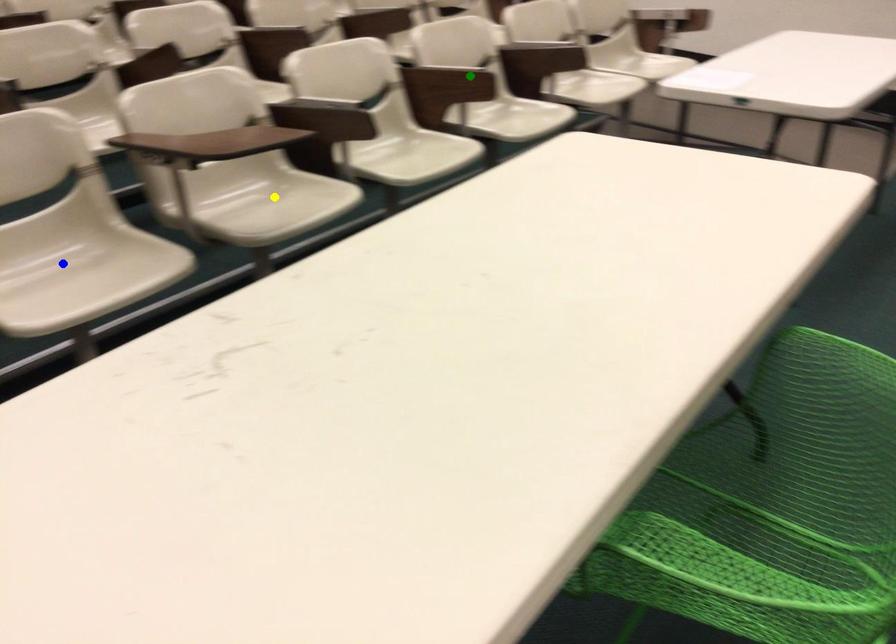
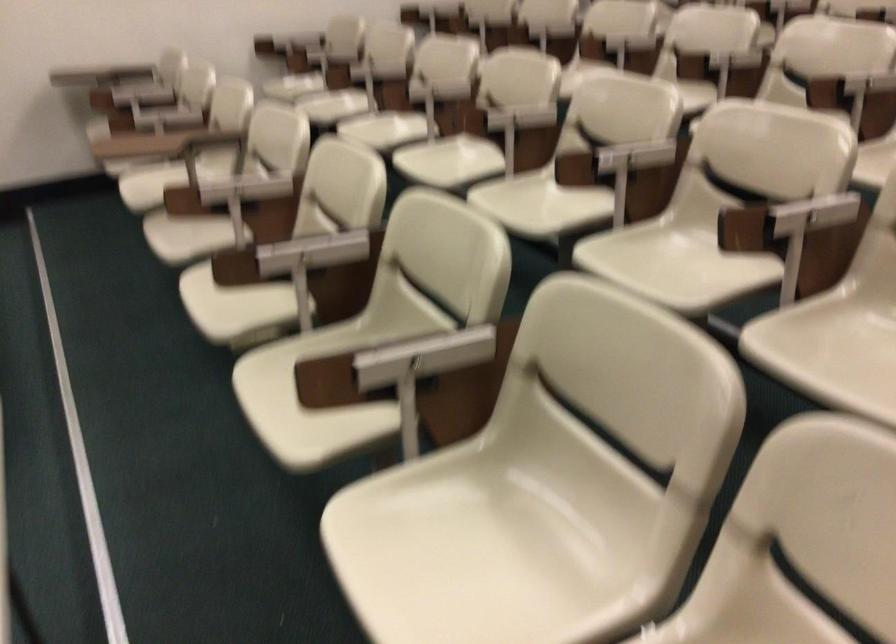
I am providing you with two images of the same scene from different viewpoints. Three points are marked in image1. Which point corresponds to a part or object that is occluded in image2?In image1, three points are marked. Which of them correspond to a part or object that is occluded in image2?Among the three points shown in image1, which one corresponds to a part or object that is no longer visible due to occlusion in image2?

Invisible in image2: yellow point, blue point.